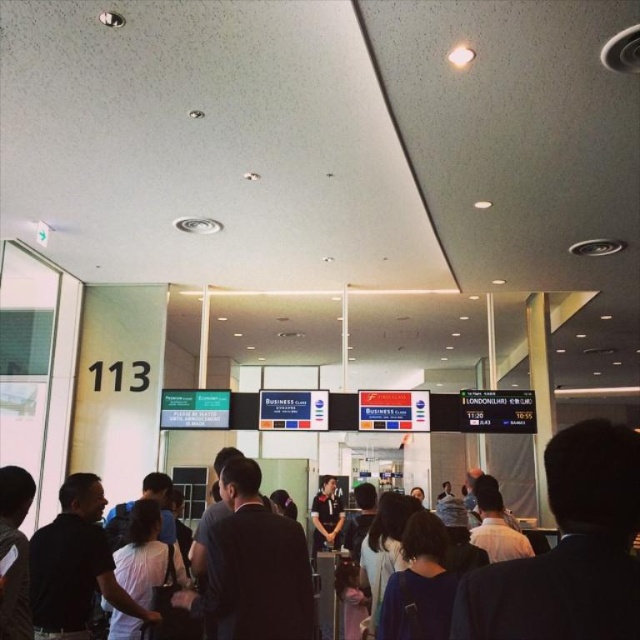
Between dark blue shirt at center and white fabric bag at center, which one appears on the right side from the viewer's perspective?

dark blue shirt at center

This screenshot has height=640, width=640. What do you see at coordinates (419, 584) in the screenshot?
I see `dark blue shirt at center` at bounding box center [419, 584].

Is point (404, 624) less distant than point (161, 554)?

Yes, point (404, 624) is closer to viewer.

You are a GUI agent. You are given a task and a screenshot of the screen. Output one action in this format:
    pyautogui.click(x=<x>, y=<y>)
    Task: Click on the dark blue shirt at center
    The image size is (640, 640).
    Given the screenshot: What is the action you would take?
    pyautogui.click(x=419, y=584)

Is dark blue suit at right further to camera compared to white fabric bag at center?

No, it is not.

Is dark blue suit at right closer to the viewer compared to white fabric bag at center?

Yes.

Which is in front, point (632, 612) or point (125, 566)?

Positioned in front is point (632, 612).

Locate an element on the screen. dark blue suit at right is located at coordinates (568, 550).

Does dark blue suit at right have a lesser width compared to dark blue shirt at center?

No, dark blue suit at right is not thinner than dark blue shirt at center.

Consider the image. Is the position of dark blue suit at right less distant than that of dark blue shirt at center?

Yes, it is.

Identify the location of dark blue suit at right. The width and height of the screenshot is (640, 640). (568, 550).

Locate an element on the screen. The height and width of the screenshot is (640, 640). dark blue suit at right is located at coordinates (568, 550).